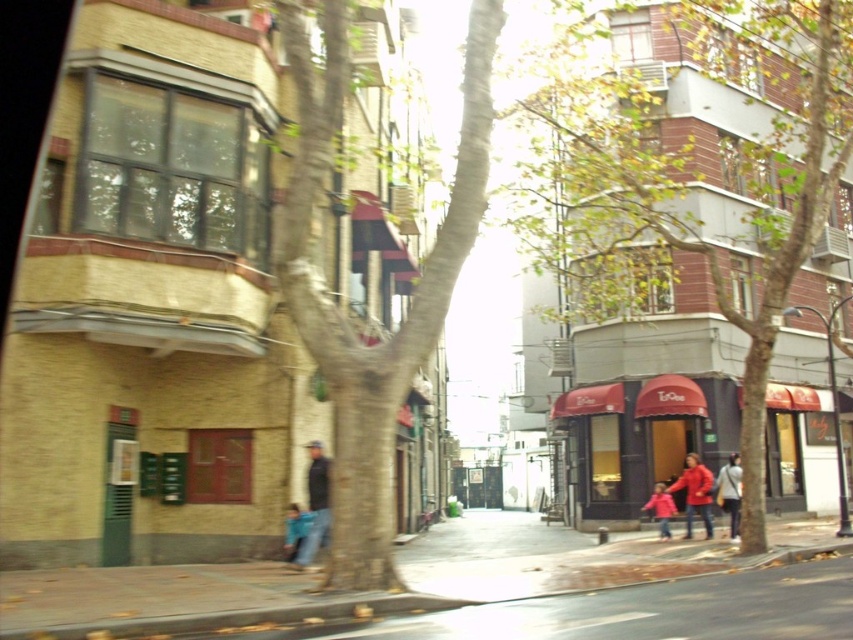
Question: Does green textured tree at center have a greater width compared to blue denim jacket at lower center?

Choices:
 (A) no
 (B) yes

Answer: (B)

Question: Which of these objects is positioned farthest from the dark blue jeans at center?

Choices:
 (A) smooth brown tree trunk at center
 (B) smooth concrete sidewalk at center
 (C) matte red jacket at center

Answer: (C)

Question: Can you confirm if dark blue jeans at center is positioned to the left of matte red jacket at center?

Choices:
 (A) yes
 (B) no

Answer: (A)

Question: Which object appears farthest from the camera in this image?

Choices:
 (A) white cotton jacket at lower right
 (B) smooth concrete sidewalk at center

Answer: (A)

Question: Does white cotton jacket at lower right come behind matte pink coat at center?

Choices:
 (A) yes
 (B) no

Answer: (B)

Question: Which object is positioned farthest from the matte red jacket at center?

Choices:
 (A) smooth concrete sidewalk at center
 (B) smooth brown tree trunk at center

Answer: (B)